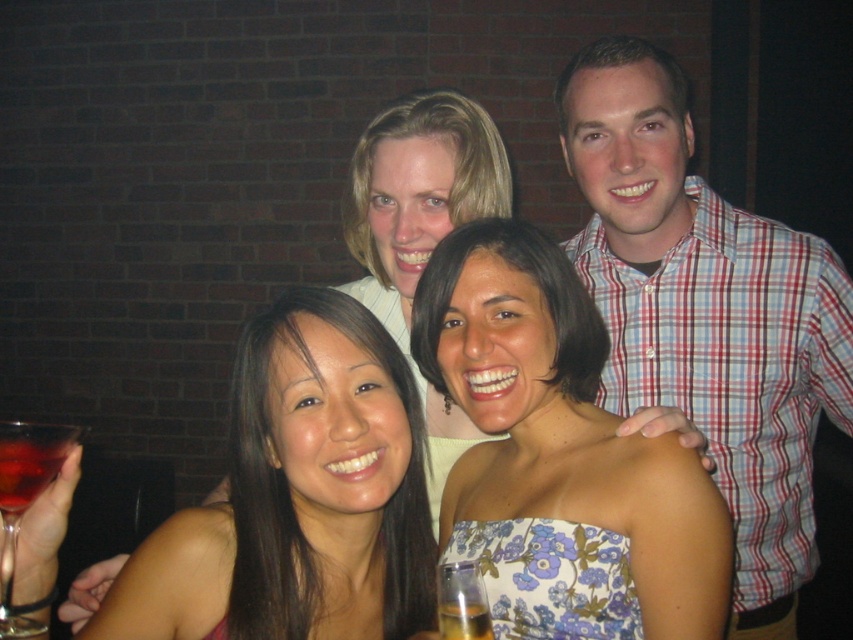
Is smooth brown hair at lower left above translucent amber liquid at lower center?

Correct, smooth brown hair at lower left is located above translucent amber liquid at lower center.

Which is more to the right, smooth brown hair at lower left or translucent amber liquid at lower center?

From the viewer's perspective, translucent amber liquid at lower center appears more on the right side.

Who is more distant from viewer, [283,637] or [488,628]?

Point [283,637]

I want to click on smooth brown hair at lower left, so click(325, 472).

Does floral print dress at center have a larger size compared to translucent amber liquid at lower center?

Indeed, floral print dress at center has a larger size compared to translucent amber liquid at lower center.

Does floral print dress at center appear on the left side of translucent amber liquid at lower center?

Incorrect, floral print dress at center is not on the left side of translucent amber liquid at lower center.

Is point (479, 374) more distant than point (444, 625)?

That is True.

Identify the location of floral print dress at center. pyautogui.click(x=560, y=456).

Who is positioned more to the right, translucent glass at lower center or translucent amber liquid at lower center?

translucent glass at lower center

Describe the element at coordinates (462, 602) in the screenshot. I see `translucent glass at lower center` at that location.

Which is behind, point (448, 637) or point (440, 609)?

The point (440, 609) is more distant.

At what (x,y) coordinates should I click in order to perform the action: click on translucent glass at lower center. Please return your answer as a coordinate pair (x, y). Image resolution: width=853 pixels, height=640 pixels. Looking at the image, I should click on (462, 602).